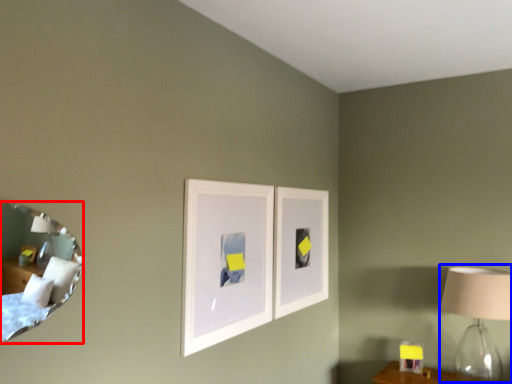
Question: Among these objects, which one is farthest to the camera, mirror (highlighted by a red box) or table lamp (highlighted by a blue box)?

Choices:
 (A) mirror
 (B) table lamp

Answer: (B)